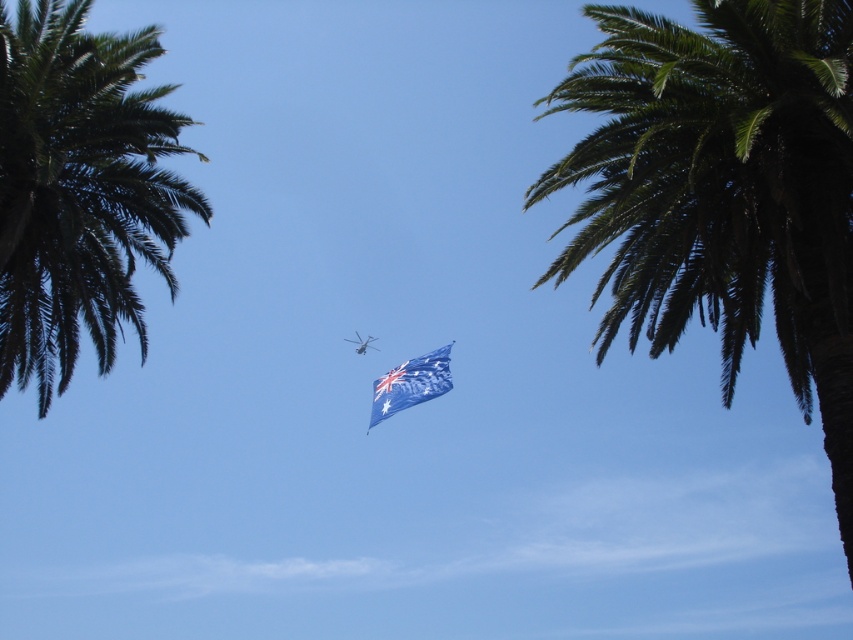
Measure the distance between green leafy palm tree at upper right and blue fabric flag at center.

The distance of green leafy palm tree at upper right from blue fabric flag at center is 38.01 meters.

The height and width of the screenshot is (640, 853). What do you see at coordinates (723, 189) in the screenshot?
I see `green leafy palm tree at upper right` at bounding box center [723, 189].

Who is more distant from viewer, (619, 81) or (439, 369)?

Point (439, 369)

The image size is (853, 640). I want to click on green leafy palm tree at upper right, so click(723, 189).

Who is positioned more to the right, green leafy palm tree at left or blue fabric flag at center?

blue fabric flag at center is more to the right.

The image size is (853, 640). What do you see at coordinates (79, 189) in the screenshot?
I see `green leafy palm tree at left` at bounding box center [79, 189].

What do you see at coordinates (79, 189) in the screenshot? I see `green leafy palm tree at left` at bounding box center [79, 189].

Image resolution: width=853 pixels, height=640 pixels. Find the location of `green leafy palm tree at left`. green leafy palm tree at left is located at coordinates (79, 189).

Is green leafy palm tree at upper right below metallic silver helicopter at center?

No.

Consider the image. Is green leafy palm tree at upper right smaller than metallic silver helicopter at center?

No, green leafy palm tree at upper right is not smaller than metallic silver helicopter at center.

Describe the element at coordinates (723, 189) in the screenshot. I see `green leafy palm tree at upper right` at that location.

Find the location of a particular element. The height and width of the screenshot is (640, 853). green leafy palm tree at upper right is located at coordinates (723, 189).